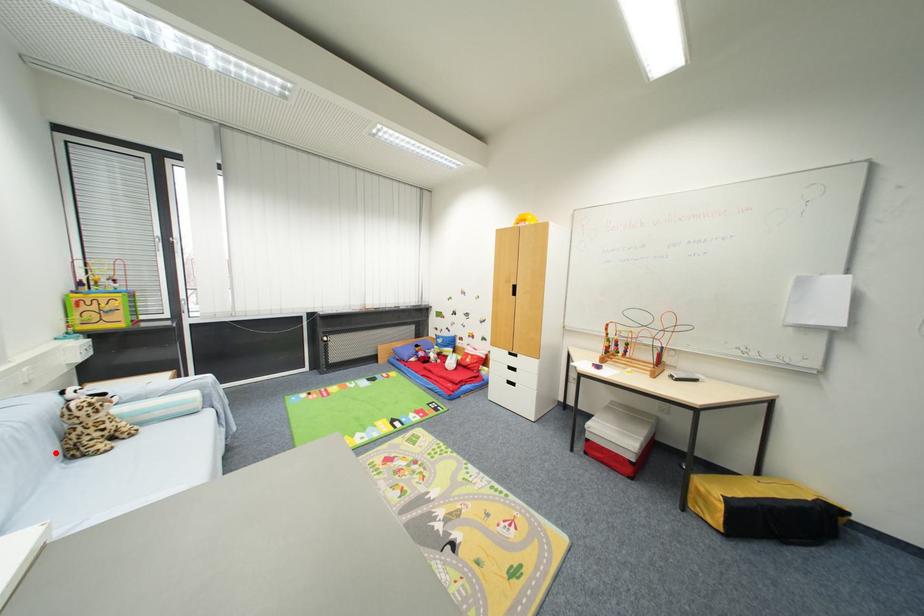
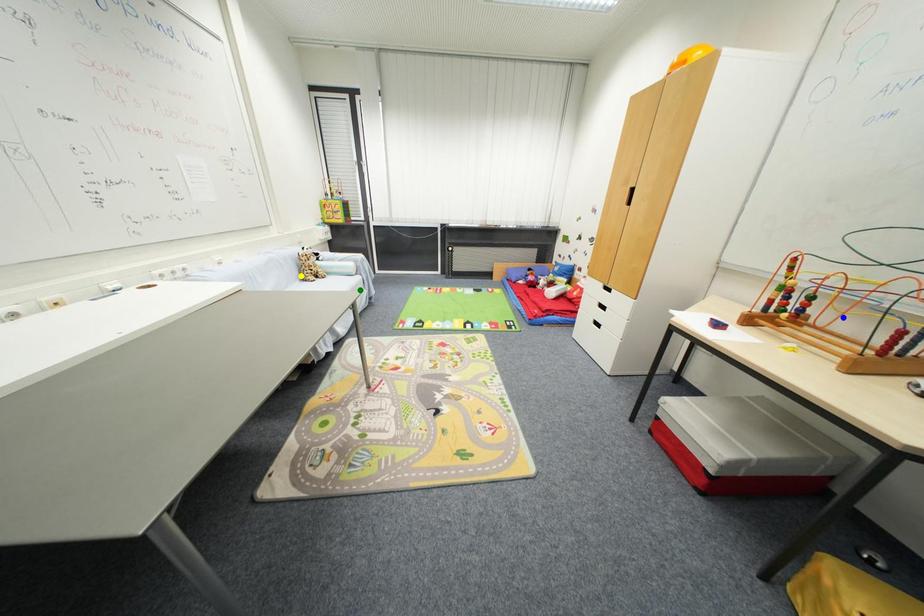
Question: I am providing you with two images of the same scene from different viewpoints. A red point is marked on the first image. You are given multiple points on the second image. Can you choose the point in image 2 that corresponds to the point in image 1?

Choices:
 (A) blue point
 (B) yellow point
 (C) green point

Answer: (B)